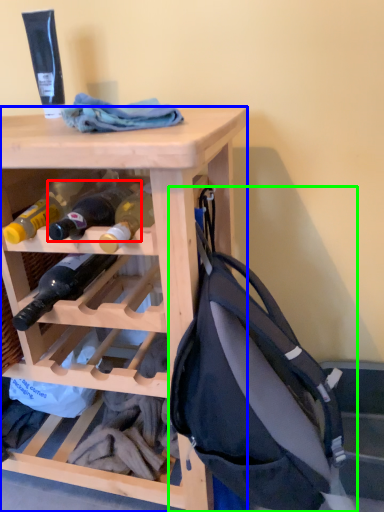
Question: Which object is the closest to the bottle (highlighted by a red box)? Choose among these: desk (highlighted by a blue box) or backpack (highlighted by a green box).

Choices:
 (A) desk
 (B) backpack

Answer: (A)